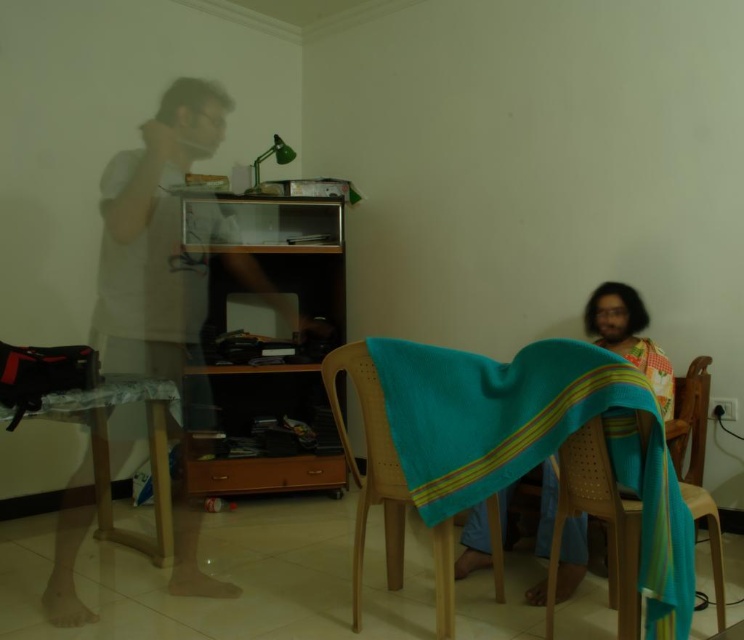
Question: Does wooden table at lower left have a lesser width compared to wooden chair at center?

Choices:
 (A) no
 (B) yes

Answer: (A)

Question: Does turquoise woven cloth at center appear on the left side of wooden chair at center?

Choices:
 (A) no
 (B) yes

Answer: (A)

Question: Is wooden chair with woven seat at lower right below wooden chair at center?

Choices:
 (A) no
 (B) yes

Answer: (A)

Question: Considering the real-world distances, which object is closest to the wooden table at lower left?

Choices:
 (A) turquoise woven cloth at center
 (B) wooden chair at center
 (C) wooden chair with woven seat at lower right

Answer: (B)

Question: Which object is closer to the camera taking this photo?

Choices:
 (A) wooden chair with woven seat at lower right
 (B) wooden table at lower left
 (C) turquoise woven cloth at center

Answer: (C)

Question: Among these points, which one is nearest to the camera?

Choices:
 (A) (615, 490)
 (B) (498, 376)
 (C) (112, 387)
 (D) (448, 627)

Answer: (A)